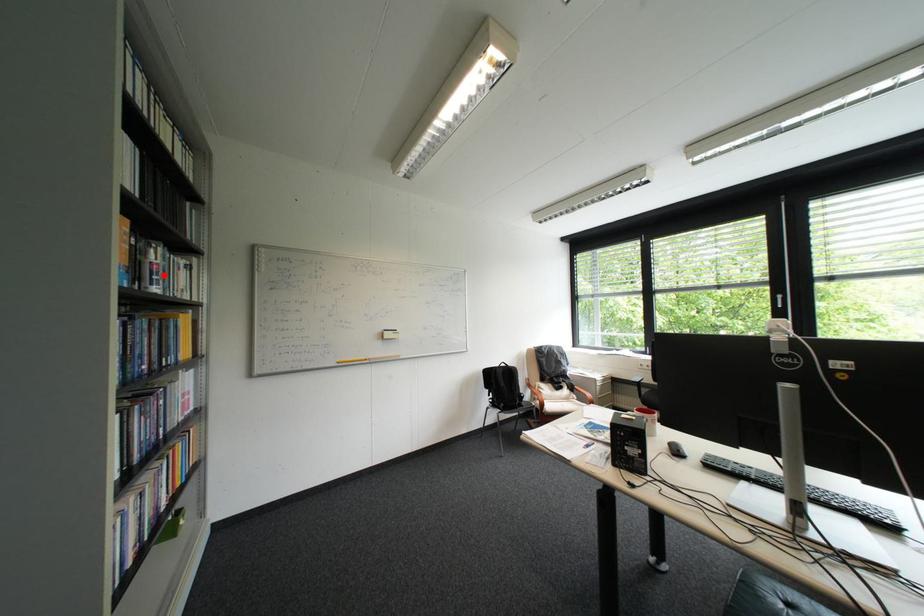
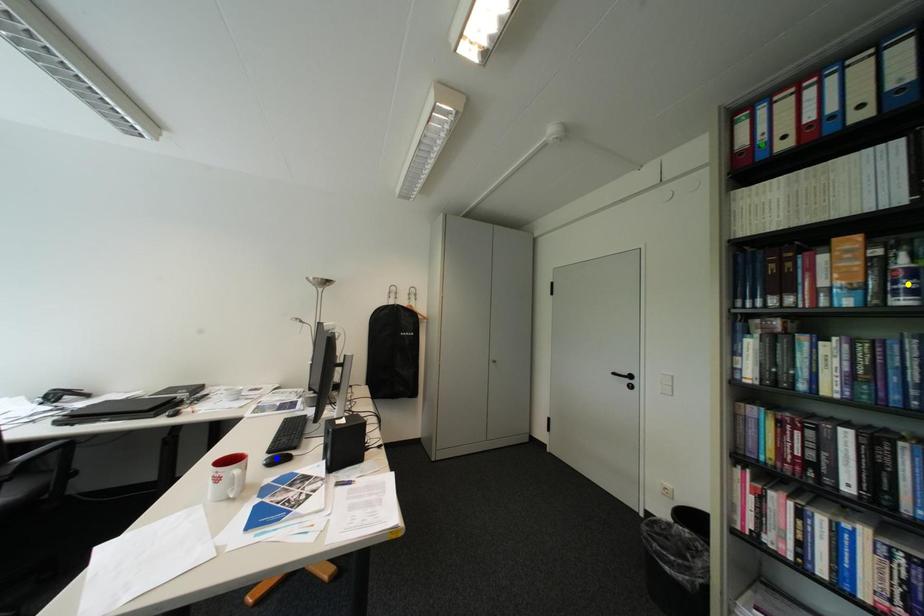
Question: I am providing you with two images of the same scene from different viewpoints. A red point is marked on the first image. You are given multiple points on the second image. Which point in image 2 is actually the same real-world point as the red point in image 1?

Choices:
 (A) blue point
 (B) yellow point
 (C) green point

Answer: (B)